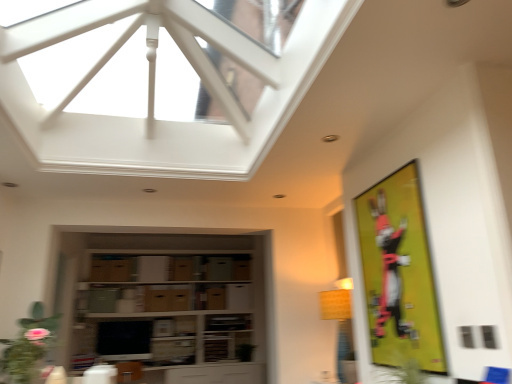
Question: Should I look upward or downward to see matte black monitor at center?

Choices:
 (A) down
 (B) up

Answer: (A)

Question: Could you tell me if matte wooden entertainment center at center is turned towards green matte plant at lower left?

Choices:
 (A) no
 (B) yes

Answer: (B)

Question: From a real-world perspective, is matte wooden entertainment center at center positioned over green matte plant at lower left based on gravity?

Choices:
 (A) no
 (B) yes

Answer: (B)

Question: Does matte wooden entertainment center at center appear on the right side of green matte plant at lower left?

Choices:
 (A) yes
 (B) no

Answer: (B)

Question: Can you confirm if matte wooden entertainment center at center is shorter than green matte plant at lower left?

Choices:
 (A) yes
 (B) no

Answer: (B)

Question: Considering the relative positions of matte wooden entertainment center at center and green matte plant at lower left in the image provided, is matte wooden entertainment center at center behind green matte plant at lower left?

Choices:
 (A) yes
 (B) no

Answer: (A)

Question: Is matte wooden entertainment center at center at the left side of green matte plant at lower left?

Choices:
 (A) no
 (B) yes

Answer: (B)

Question: Does matte black monitor at center have a lesser width compared to green matte plant at lower left?

Choices:
 (A) no
 (B) yes

Answer: (B)

Question: Does matte black monitor at center have a larger size compared to green matte plant at lower left?

Choices:
 (A) yes
 (B) no

Answer: (A)

Question: Does matte black monitor at center have a lesser height compared to green matte plant at lower left?

Choices:
 (A) no
 (B) yes

Answer: (A)

Question: From the image's perspective, is matte black monitor at center under green matte plant at lower left?

Choices:
 (A) yes
 (B) no

Answer: (A)

Question: Does matte black monitor at center have a smaller size compared to green matte plant at lower left?

Choices:
 (A) yes
 (B) no

Answer: (B)

Question: From the image's perspective, does matte black monitor at center appear higher than green matte plant at lower left?

Choices:
 (A) no
 (B) yes

Answer: (A)

Question: Does yellow matte bulletin board at right turn towards green matte plant at lower left?

Choices:
 (A) yes
 (B) no

Answer: (A)